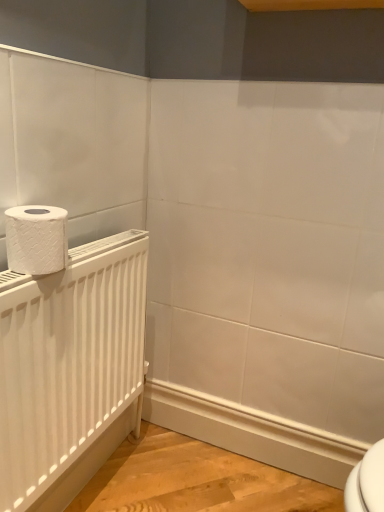
Question: Can you confirm if white matte radiator at left is positioned to the left of white textured toilet paper at left?

Choices:
 (A) yes
 (B) no

Answer: (B)

Question: Considering the relative sizes of white matte radiator at left and white textured toilet paper at left in the image provided, is white matte radiator at left thinner than white textured toilet paper at left?

Choices:
 (A) no
 (B) yes

Answer: (B)

Question: From a real-world perspective, does white matte radiator at left sit lower than white textured toilet paper at left?

Choices:
 (A) no
 (B) yes

Answer: (B)

Question: Is white matte radiator at left bigger than white textured toilet paper at left?

Choices:
 (A) yes
 (B) no

Answer: (A)

Question: Considering the relative positions of white matte radiator at left and white textured toilet paper at left in the image provided, is white matte radiator at left to the right of white textured toilet paper at left from the viewer's perspective?

Choices:
 (A) no
 (B) yes

Answer: (B)

Question: Is there a large distance between white matte radiator at left and white textured toilet paper at left?

Choices:
 (A) yes
 (B) no

Answer: (B)

Question: Is white textured toilet paper at left to the left of white matte radiator at left from the viewer's perspective?

Choices:
 (A) no
 (B) yes

Answer: (B)

Question: Is white textured toilet paper at left not close to white matte radiator at left?

Choices:
 (A) yes
 (B) no

Answer: (B)

Question: Is white textured toilet paper at left taller than white matte radiator at left?

Choices:
 (A) no
 (B) yes

Answer: (A)

Question: Is white textured toilet paper at left next to white matte radiator at left and touching it?

Choices:
 (A) no
 (B) yes

Answer: (A)

Question: Considering the relative positions of white textured toilet paper at left and white matte radiator at left in the image provided, is white textured toilet paper at left behind white matte radiator at left?

Choices:
 (A) yes
 (B) no

Answer: (A)

Question: Could you tell me if white textured toilet paper at left is facing white matte radiator at left?

Choices:
 (A) yes
 (B) no

Answer: (B)

Question: Is point (16, 258) positioned closer to the camera than point (74, 297)?

Choices:
 (A) farther
 (B) closer

Answer: (B)